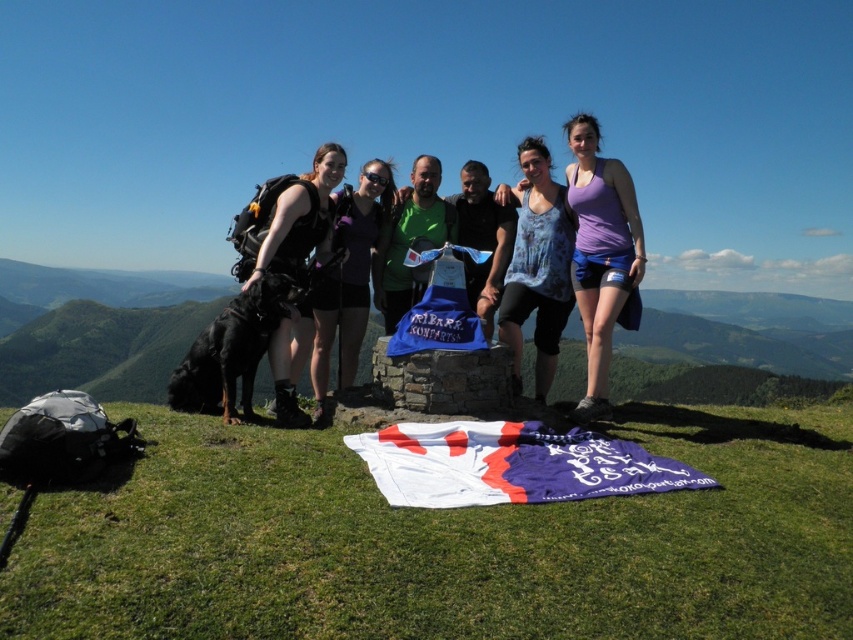
Which of these two, purple fabric at center or matte black backpack at center, stands taller?

With more height is purple fabric at center.

Is point (579, 241) farther from camera compared to point (381, 230)?

No, (579, 241) is in front of (381, 230).

Locate an element on the screen. purple fabric at center is located at coordinates (601, 256).

Who is lower down, white fabric banner at center or blue fabric at center?

Positioned lower is white fabric banner at center.

Is white fabric banner at center positioned at the back of blue fabric at center?

No, it is not.

Describe the element at coordinates (509, 465) in the screenshot. The height and width of the screenshot is (640, 853). I see `white fabric banner at center` at that location.

This screenshot has height=640, width=853. In order to click on white fabric banner at center in this screenshot , I will do `click(509, 465)`.

Which of these two, purple fabric at center or matte black backpack at left, stands taller?

Standing taller between the two is purple fabric at center.

What do you see at coordinates (601, 256) in the screenshot? I see `purple fabric at center` at bounding box center [601, 256].

Identify the location of purple fabric at center. This screenshot has height=640, width=853. (601, 256).